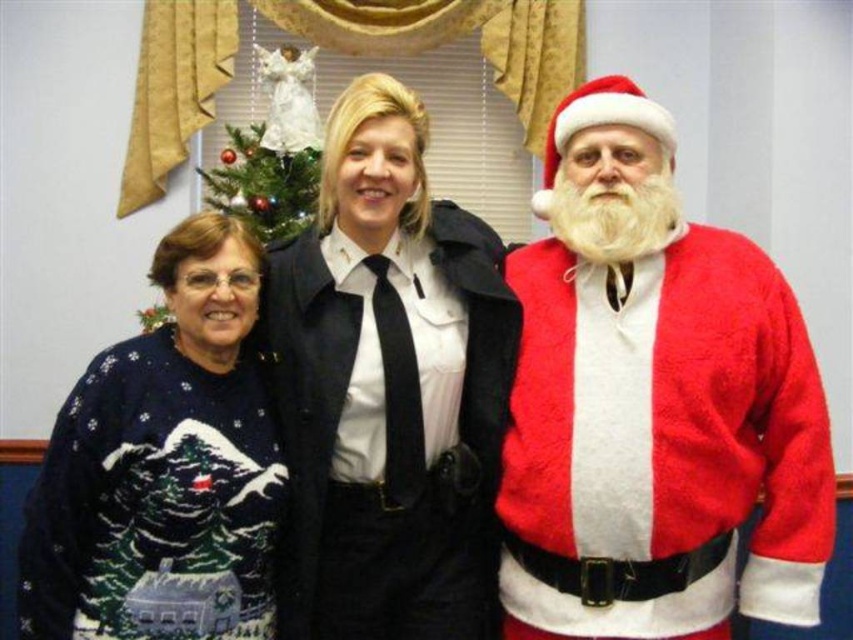
Locate an element on the screen. This screenshot has width=853, height=640. fuzzy red santa at right is located at coordinates (653, 404).

What do you see at coordinates (653, 404) in the screenshot? I see `fuzzy red santa at right` at bounding box center [653, 404].

Where is `fuzzy red santa at right`? fuzzy red santa at right is located at coordinates (653, 404).

Is point (732, 554) positioned before point (247, 330)?

Yes, it is.

Who is taller, fuzzy red santa at right or navy sweater at left?

Standing taller between the two is fuzzy red santa at right.

The image size is (853, 640). What are the coordinates of `fuzzy red santa at right` in the screenshot? It's located at (653, 404).

The image size is (853, 640). In order to click on fuzzy red santa at right in this screenshot , I will do `click(653, 404)`.

Can you confirm if matte black uniform at center is positioned below navy sweater at left?

No.

Describe the element at coordinates (387, 388) in the screenshot. I see `matte black uniform at center` at that location.

You are a GUI agent. You are given a task and a screenshot of the screen. Output one action in this format:
    pyautogui.click(x=<x>, y=<y>)
    Task: Click on the matte black uniform at center
    
    Given the screenshot: What is the action you would take?
    (x=387, y=388)